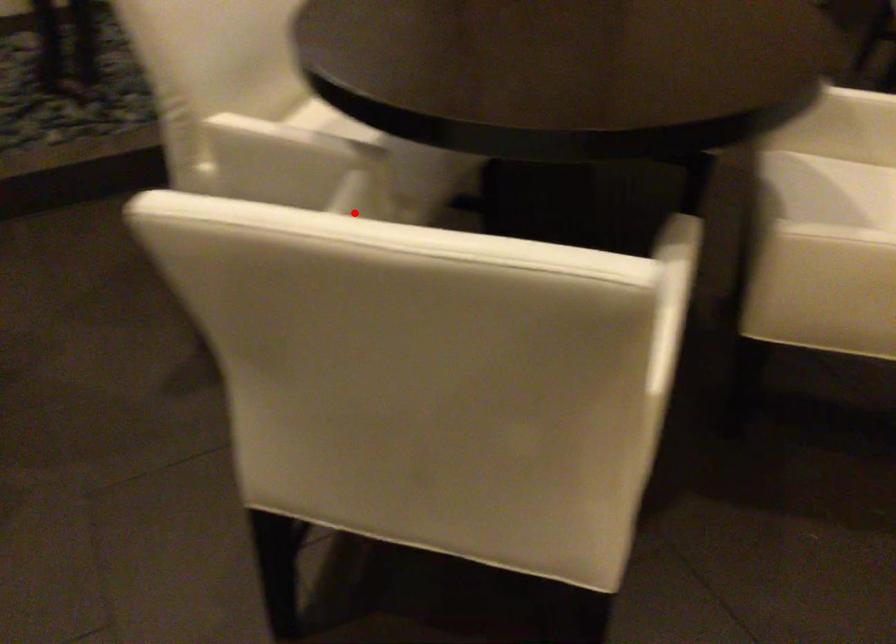
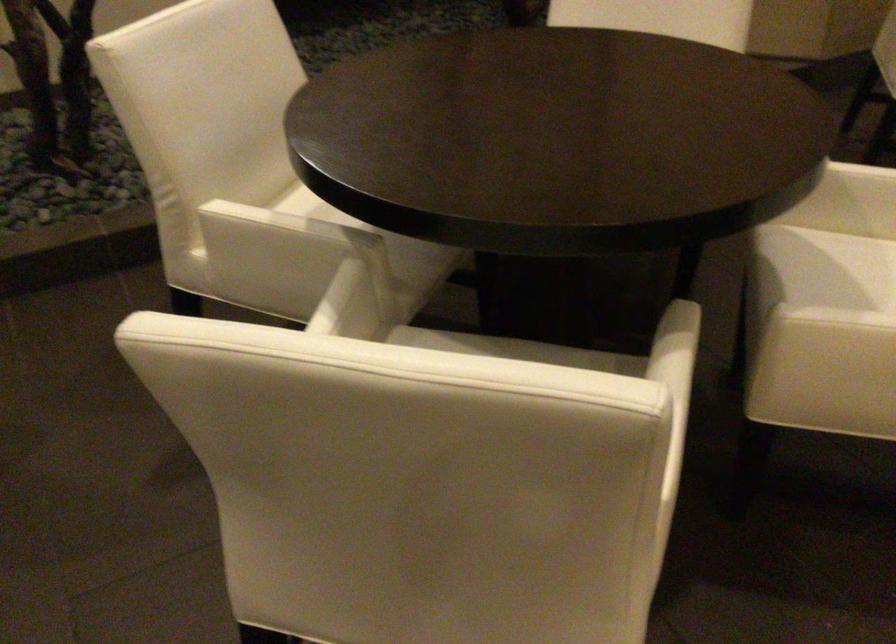
Find the pixel in the second image that matches the highlighted location in the first image.

(348, 305)